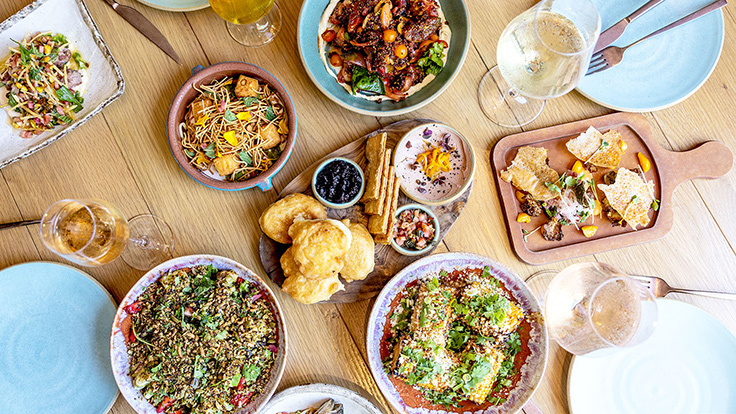
Where is `serving tray`? serving tray is located at coordinates (675, 173).